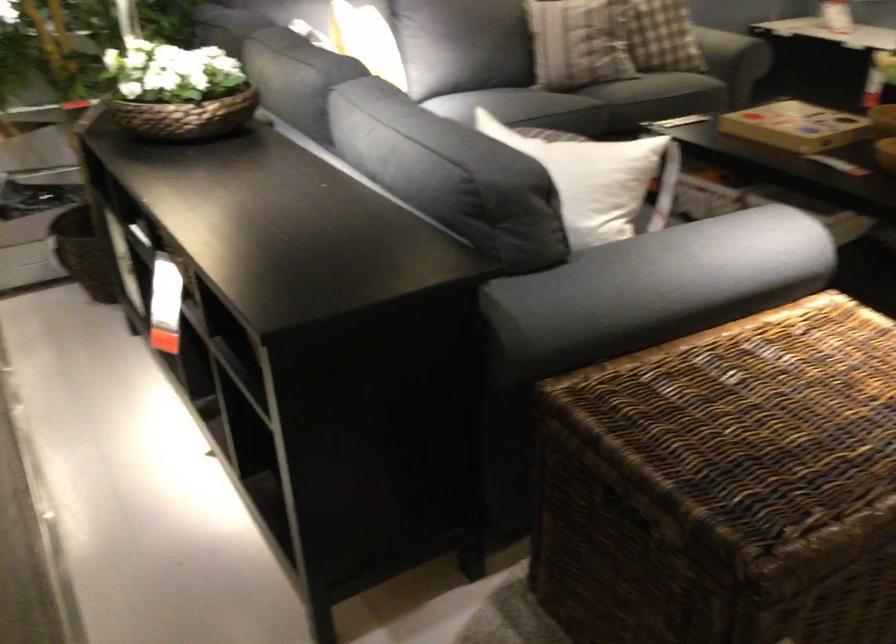
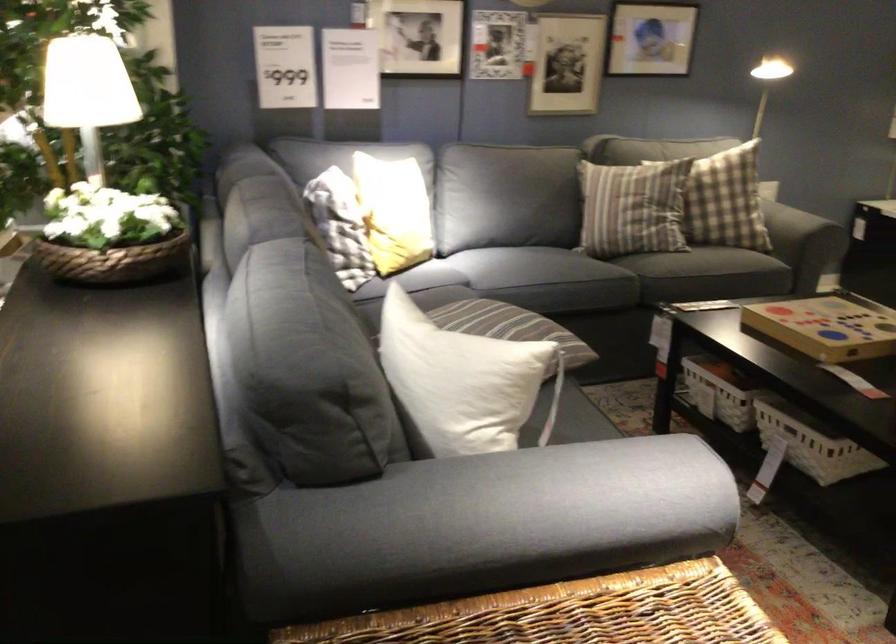
In the second image, find the point that corresponds to the point at 688,263 in the first image.

(528, 500)